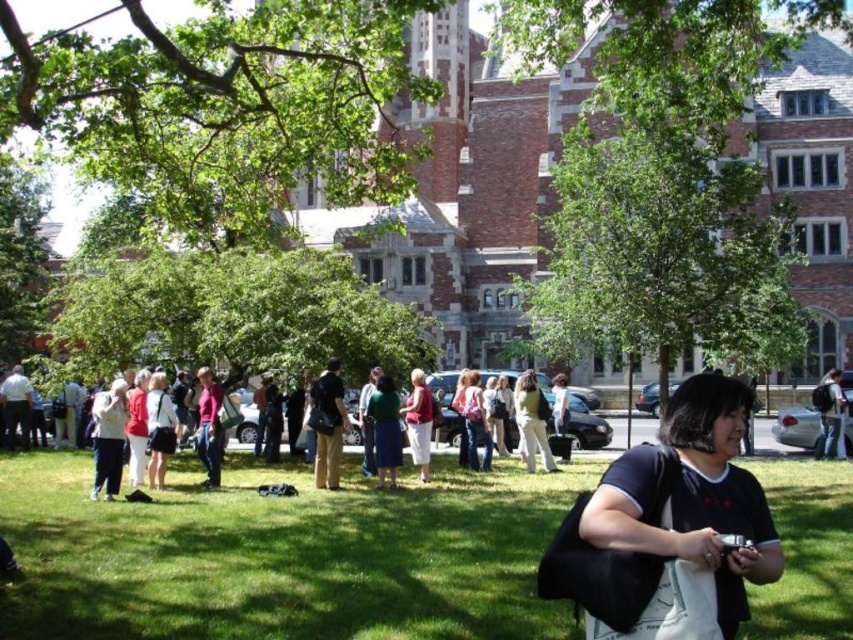
Question: Which of these objects is positioned closest to the matte black bag at center?

Choices:
 (A) matte black pants at left
 (B) matte white pants at center

Answer: (A)

Question: Is matte pink shirt at center below denim pants at center?

Choices:
 (A) yes
 (B) no

Answer: (A)

Question: Which of these objects is positioned closest to the green fabric dress at center?

Choices:
 (A) matte white shirt at lower left
 (B) matte black bag at center

Answer: (B)

Question: Observing the image, what is the correct spatial positioning of green leafy tree at center in reference to black matte shirt at center?

Choices:
 (A) left
 (B) right

Answer: (B)

Question: Which of the following is the closest to the observer?

Choices:
 (A) multicolored casual attire at center
 (B) green leafy tree at upper left

Answer: (B)

Question: In this image, where is matte white shirt at lower left located relative to matte white pants at center?

Choices:
 (A) right
 (B) left

Answer: (B)